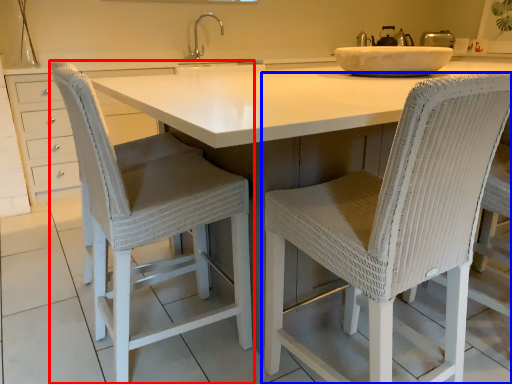
Question: Which object is further to the camera taking this photo, chair (highlighted by a red box) or chair (highlighted by a blue box)?

Choices:
 (A) chair
 (B) chair

Answer: (A)